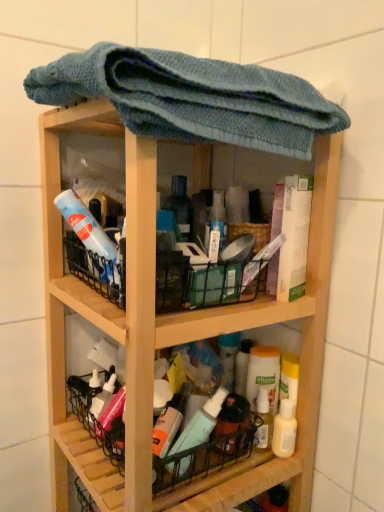
Question: In the image, is translucent plastic mouthwash at lower right positioned in front of or behind wooden shelf at center?

Choices:
 (A) front
 (B) behind

Answer: (B)

Question: From the image's perspective, is translucent plastic mouthwash at lower right above or below wooden shelf at center?

Choices:
 (A) above
 (B) below

Answer: (B)

Question: Considering the real-world distances, which object is closest to the blue knitted towel at upper center?

Choices:
 (A) wooden shelf at center
 (B) translucent plastic mouthwash at lower right
 (C) metallic black basket at lower center

Answer: (A)

Question: Based on their relative distances, which object is farther from the metallic black basket at lower center?

Choices:
 (A) translucent plastic mouthwash at lower right
 (B) blue knitted towel at upper center
 (C) wooden shelf at center

Answer: (B)